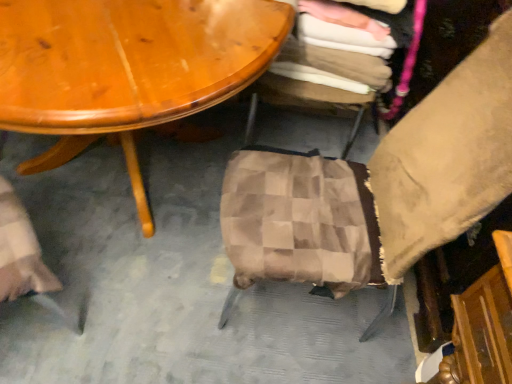
Image resolution: width=512 pixels, height=384 pixels. Identify the location of vacant region to the left of brown checkered fabric at center, arranged as the second chair when viewed from the back. (135, 231).